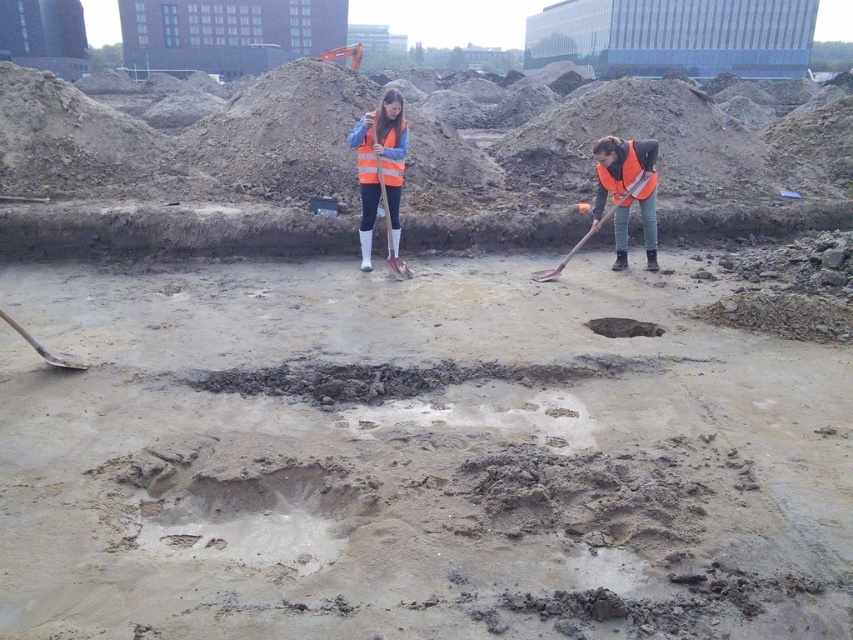
Between shiny metallic puddle at center and metallic silver shovel at lower left, which one is positioned higher?

Positioned higher is shiny metallic puddle at center.

Does point (608, 321) lie in front of point (78, 362)?

No, (608, 321) is further to viewer.

Which is behind, point (643, 332) or point (57, 364)?

Point (643, 332)

Where is `shiny metallic puddle at center`? shiny metallic puddle at center is located at coordinates click(624, 326).

Can you confirm if orange reflective safety vest at right is positioned to the right of metallic shovel at right?

Indeed, orange reflective safety vest at right is positioned on the right side of metallic shovel at right.

Who is more distant from viewer, (x=634, y=189) or (x=595, y=227)?

The point (x=634, y=189) is more distant.

Who is more distant from viewer, (637, 166) or (640, 188)?

The point (640, 188) is more distant.

Where is `orange reflective safety vest at right`? The width and height of the screenshot is (853, 640). orange reflective safety vest at right is located at coordinates (621, 170).

This screenshot has width=853, height=640. Describe the element at coordinates (624, 326) in the screenshot. I see `shiny metallic puddle at center` at that location.

Is shiny metallic puddle at center wider than orange plastic shovel at center?

Correct, the width of shiny metallic puddle at center exceeds that of orange plastic shovel at center.

Who is more forward, (606, 320) or (399, 272)?

Point (606, 320) is more forward.

Where is `shiny metallic puddle at center`? The height and width of the screenshot is (640, 853). shiny metallic puddle at center is located at coordinates pos(624,326).